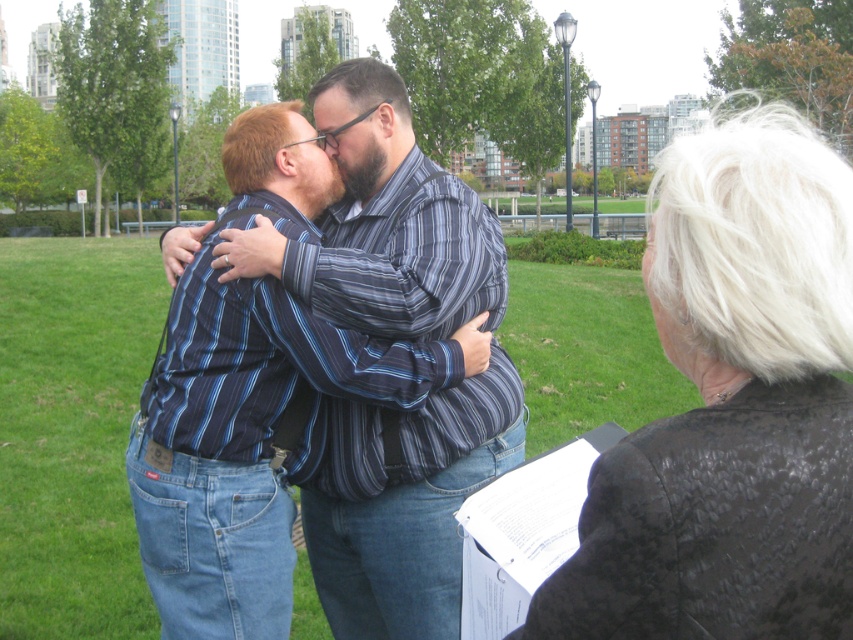
You are standing in the park and want to take a photo of the two people embracing. You notice two points marked in the scene. Which point is closer to you, point (672, 564) or point (369, 548)?

Point (672, 564) is closer to the viewer than point (369, 548).

You are a photographer at the park and want to capture a closeup of the white textured hair at upper right without including the striped shirt at center in the frame. Is this possible given their positions?

The white textured hair at upper right is closer to the viewer than the striped shirt at center, so yes, you can focus on the white textured hair at upper right and exclude the striped shirt at center by adjusting the camera angle or zoom.

You are a photographer at a park who wants to capture a candid shot of the two people embracing without being noticed. You have a camera with a 1.5 meter focal length. The white textured hair at upper right is an observer holding a clipboard. Can you take the photo without the observer noticing?

The distance between the white textured hair at upper right and the camera is 1.38 meters, which is within the 1.5 meter focal length. Therefore, you can take the photo without the observer noticing.